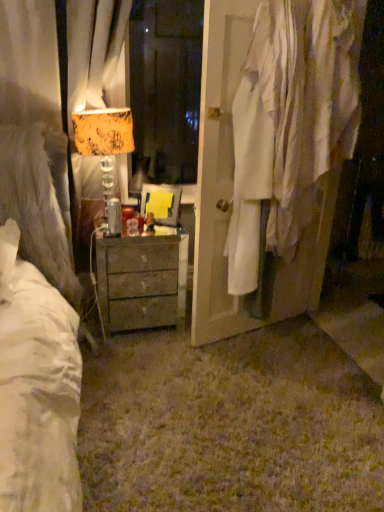
The height and width of the screenshot is (512, 384). What are the coordinates of `rustic wood chest of drawers at center` in the screenshot? It's located at (142, 280).

What is the approximate width of rustic wood chest of drawers at center?

rustic wood chest of drawers at center is 13.03 inches in width.

Where is `orange-patterned fabric lampshade at left`? orange-patterned fabric lampshade at left is located at coordinates [x=103, y=131].

From the image's perspective, is orange-patterned fabric lampshade at left on top of white fabric at right?

No.

Where is `clothing in front of the orange-patterned fabric lampshade at left`? This screenshot has width=384, height=512. clothing in front of the orange-patterned fabric lampshade at left is located at coordinates (291, 122).

Relative to white fabric at right, is orange-patterned fabric lampshade at left in front or behind?

Clearly, orange-patterned fabric lampshade at left is behind white fabric at right.

Does point (110, 116) appear closer or farther from the camera than point (261, 143)?

Point (110, 116).

Relative to rustic wood chest of drawers at center, is white fabric at right in front or behind?

white fabric at right is in front of rustic wood chest of drawers at center.

From a real-world perspective, between white fabric at right and rustic wood chest of drawers at center, who is vertically lower?

rustic wood chest of drawers at center.

Is point (282, 32) farther from viewer compared to point (126, 288)?

No, (282, 32) is in front of (126, 288).

In the scene shown: Is rustic wood chest of drawers at center located within white fabric at right?

No, rustic wood chest of drawers at center is not a part of white fabric at right.

Is orange-patterned fabric lampshade at left oriented towards rustic wood chest of drawers at center?

No.

Would you say orange-patterned fabric lampshade at left is outside rustic wood chest of drawers at center?

That's correct, orange-patterned fabric lampshade at left is outside of rustic wood chest of drawers at center.

From a real-world perspective, which is physically above, orange-patterned fabric lampshade at left or rustic wood chest of drawers at center?

orange-patterned fabric lampshade at left, from a real-world perspective.

From the picture: Can you confirm if orange-patterned fabric lampshade at left is positioned to the right of rustic wood chest of drawers at center?

No.

How different are the orientations of rustic wood chest of drawers at center and white fabric at right in degrees?

They differ by 17.1 degrees in their facing directions.

From a real-world perspective, between rustic wood chest of drawers at center and white fabric at right, who is vertically lower?

rustic wood chest of drawers at center, from a real-world perspective.

Which of these two, rustic wood chest of drawers at center or white fabric at right, stands shorter?

With less height is rustic wood chest of drawers at center.

Measure the distance between rustic wood chest of drawers at center and white fabric at right.

A distance of 27.56 inches exists between rustic wood chest of drawers at center and white fabric at right.

This screenshot has height=512, width=384. I want to click on table lamp on the left of white fabric at right, so click(x=103, y=131).

Considering the relative sizes of white fabric at right and orange-patterned fabric lampshade at left in the image provided, is white fabric at right wider than orange-patterned fabric lampshade at left?

Yes.

Is point (269, 39) more distant than point (119, 128)?

No, it is not.

Is white fabric at right positioned beyond the bounds of orange-patterned fabric lampshade at left?

That's correct, white fabric at right is outside of orange-patterned fabric lampshade at left.

Considering the positions of point (181, 272) and point (103, 131), is point (181, 272) closer or farther from the camera than point (103, 131)?

Point (181, 272) is farther from the camera than point (103, 131).

Considering the relative positions of rustic wood chest of drawers at center and orange-patterned fabric lampshade at left in the image provided, is rustic wood chest of drawers at center in front of orange-patterned fabric lampshade at left?

That is False.

From the image's perspective, which one is positioned lower, rustic wood chest of drawers at center or orange-patterned fabric lampshade at left?

rustic wood chest of drawers at center appears lower in the image.

Can we say rustic wood chest of drawers at center lies outside orange-patterned fabric lampshade at left?

That's correct, rustic wood chest of drawers at center is outside of orange-patterned fabric lampshade at left.

Where is `clothing above the orange-patterned fabric lampshade at left (from a real-world perspective)`? This screenshot has height=512, width=384. clothing above the orange-patterned fabric lampshade at left (from a real-world perspective) is located at coordinates (291, 122).

Locate an element on the screen. The height and width of the screenshot is (512, 384). the chest of drawers that appears below the white fabric at right (from a real-world perspective) is located at coordinates (142, 280).

Which object lies further to the anchor point white fabric at right, orange-patterned fabric lampshade at left or rustic wood chest of drawers at center?

orange-patterned fabric lampshade at left lies further to white fabric at right than the other object.

Which object lies further to the anchor point rustic wood chest of drawers at center, white fabric at right or orange-patterned fabric lampshade at left?

white fabric at right is positioned further to the anchor rustic wood chest of drawers at center.

Which object lies nearer to the anchor point white fabric at right, rustic wood chest of drawers at center or orange-patterned fabric lampshade at left?

rustic wood chest of drawers at center is positioned closer to the anchor white fabric at right.

Which object lies nearer to the anchor point rustic wood chest of drawers at center, orange-patterned fabric lampshade at left or white fabric at right?

orange-patterned fabric lampshade at left.

Which object lies further to the anchor point orange-patterned fabric lampshade at left, white fabric at right or rustic wood chest of drawers at center?

white fabric at right is positioned further to the anchor orange-patterned fabric lampshade at left.

From the image, which object appears to be nearer to orange-patterned fabric lampshade at left, rustic wood chest of drawers at center or white fabric at right?

rustic wood chest of drawers at center.

The width and height of the screenshot is (384, 512). Identify the location of chest of drawers between orange-patterned fabric lampshade at left and white fabric at right in the horizontal direction. (142, 280).